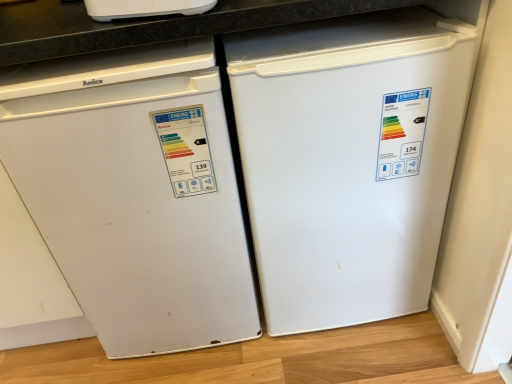
Question: Could white matte refrigerator at left be considered to be inside white matte refrigerator at right?

Choices:
 (A) yes
 (B) no

Answer: (B)

Question: Is white matte refrigerator at right oriented towards white matte refrigerator at left?

Choices:
 (A) yes
 (B) no

Answer: (B)

Question: Is white matte refrigerator at right positioned with its back to white matte refrigerator at left?

Choices:
 (A) no
 (B) yes

Answer: (A)

Question: Is white matte refrigerator at right wider than white matte refrigerator at left?

Choices:
 (A) no
 (B) yes

Answer: (B)

Question: Can we say white matte refrigerator at right lies outside white matte refrigerator at left?

Choices:
 (A) no
 (B) yes

Answer: (B)

Question: From a real-world perspective, is white matte refrigerator at right physically below white matte refrigerator at left?

Choices:
 (A) no
 (B) yes

Answer: (B)

Question: Does white matte refrigerator at left come in front of white matte refrigerator at right?

Choices:
 (A) yes
 (B) no

Answer: (A)

Question: Is white matte refrigerator at left at the right side of white matte refrigerator at right?

Choices:
 (A) yes
 (B) no

Answer: (B)

Question: Considering the relative sizes of white matte refrigerator at left and white matte refrigerator at right in the image provided, is white matte refrigerator at left taller than white matte refrigerator at right?

Choices:
 (A) yes
 (B) no

Answer: (A)

Question: Is white matte refrigerator at left positioned behind white matte refrigerator at right?

Choices:
 (A) no
 (B) yes

Answer: (A)

Question: From a real-world perspective, is white matte refrigerator at left on white matte refrigerator at right?

Choices:
 (A) yes
 (B) no

Answer: (A)

Question: Is white matte refrigerator at left positioned beyond the bounds of white matte refrigerator at right?

Choices:
 (A) no
 (B) yes

Answer: (B)

Question: From the image's perspective, relative to white matte refrigerator at right, is white matte refrigerator at left above or below?

Choices:
 (A) above
 (B) below

Answer: (B)